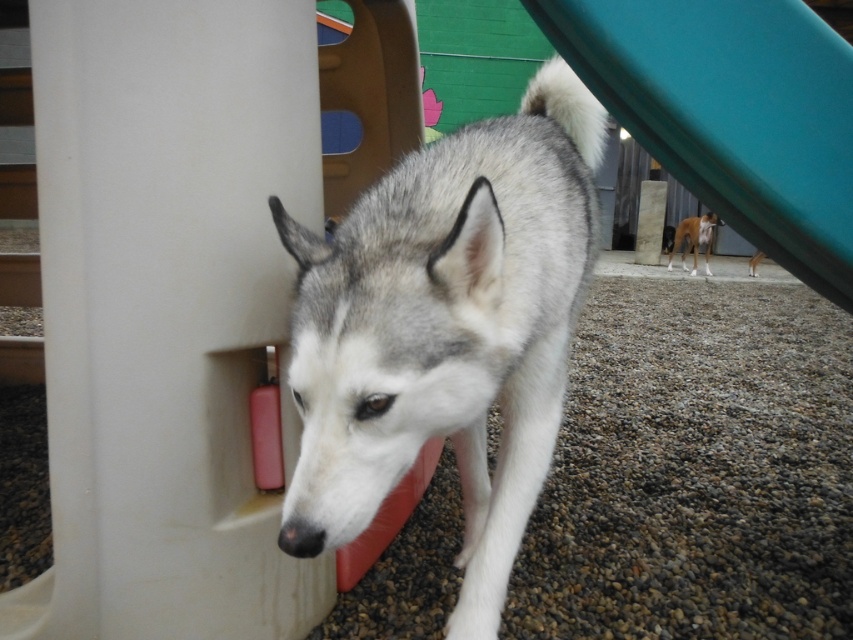
Between green plastic slide at upper right and light brown fur at center, which one is positioned lower?

green plastic slide at upper right is lower down.

This screenshot has height=640, width=853. Identify the location of green plastic slide at upper right. (730, 113).

Is gray fur dog at center thinner than green plastic slide at upper right?

Yes, gray fur dog at center is thinner than green plastic slide at upper right.

Is gray fur dog at center shorter than green plastic slide at upper right?

No.

Who is more distant from viewer, (401, 340) or (605, 35)?

The point (605, 35) is more distant.

Locate an element on the screen. gray fur dog at center is located at coordinates (445, 328).

Does light brown fur at center come in front of brown fur dog at center?

That is False.

Is point (691, 243) farther from camera compared to point (752, 260)?

Yes.

From the picture: Who is more forward, (677, 236) or (753, 257)?

Point (753, 257)

Identify the location of light brown fur at center. Image resolution: width=853 pixels, height=640 pixels. (694, 237).